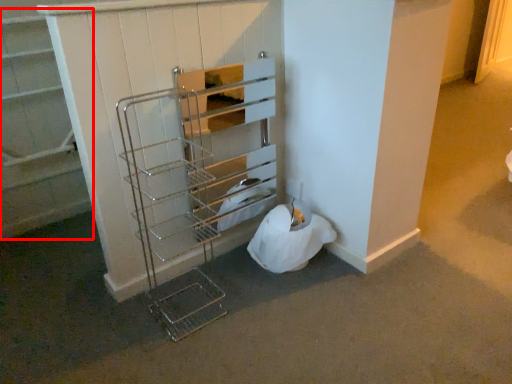
Question: From the image's perspective, considering the relative positions of shelf (annotated by the red box) and shelf in the image provided, where is shelf (annotated by the red box) located with respect to the staircase?

Choices:
 (A) below
 (B) above

Answer: (B)